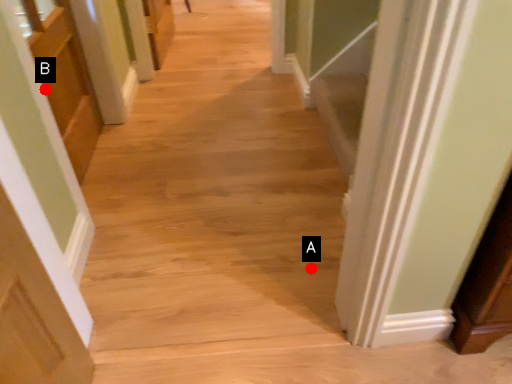
Question: Two points are circled on the image, labeled by A and B beside each circle. Which point is closer to the camera?

Choices:
 (A) A is closer
 (B) B is closer

Answer: (A)